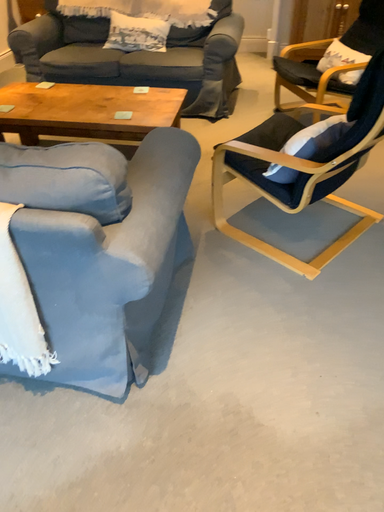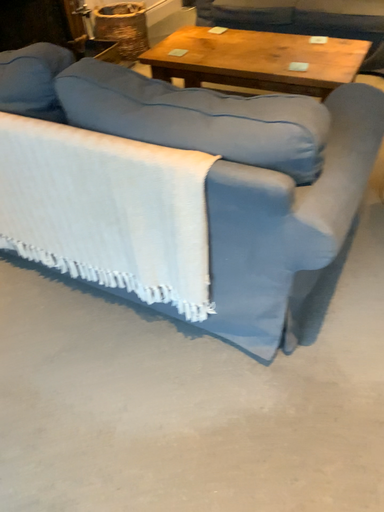
Question: How did the camera likely rotate when shooting the video?

Choices:
 (A) rotated right
 (B) rotated left

Answer: (B)